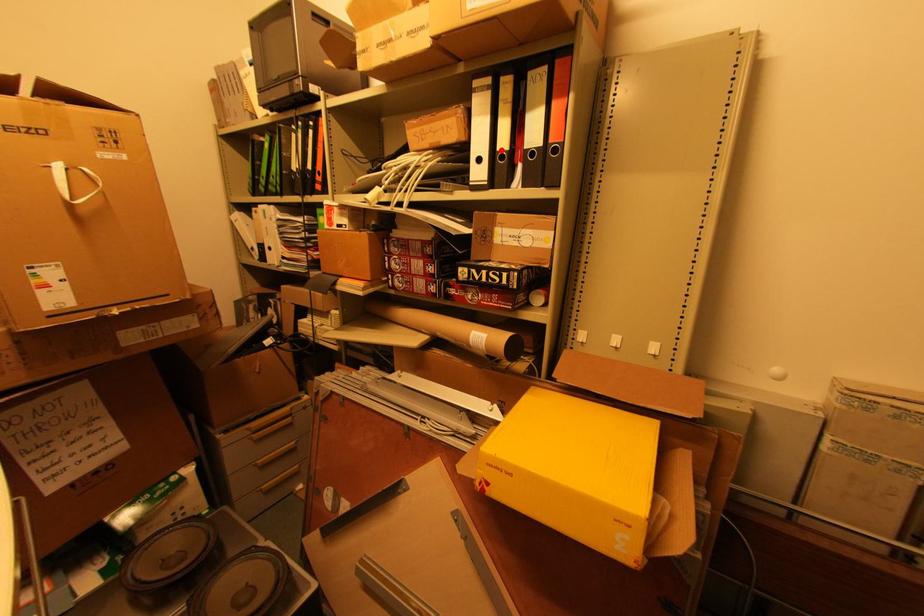
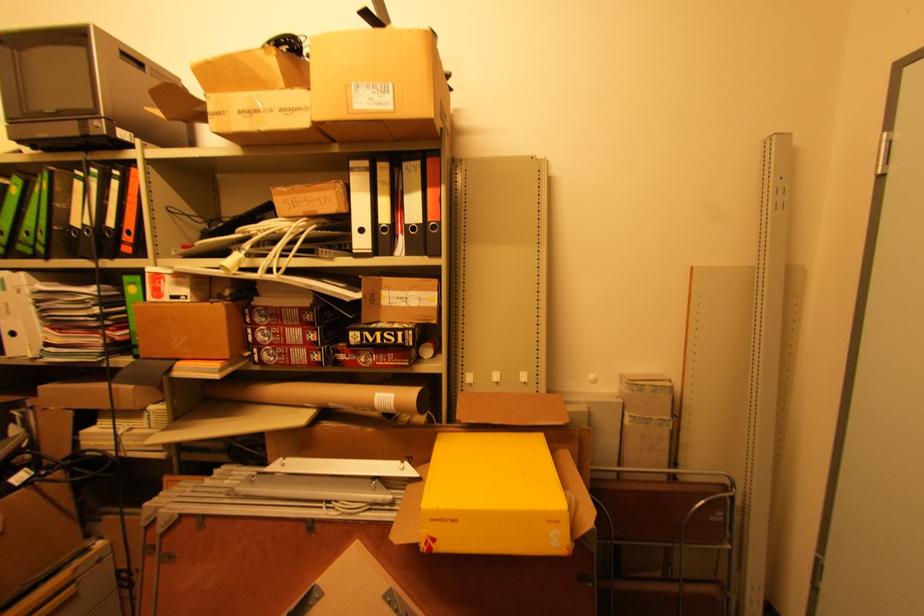
The point at the highlighted location is marked in the first image. Where is the corresponding point in the second image?

(383, 223)